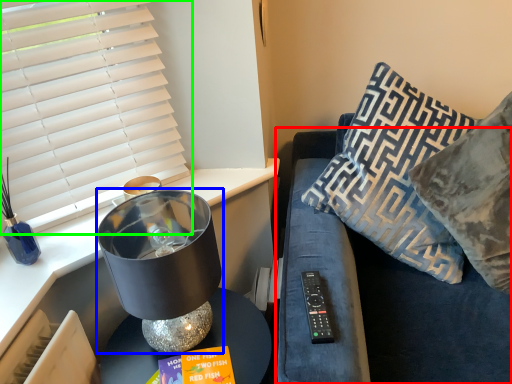
Question: Considering the real-world distances, which object is farthest from couch (highlighted by a red box)? table lamp (highlighted by a blue box) or window blind (highlighted by a green box)?

Choices:
 (A) table lamp
 (B) window blind

Answer: (B)